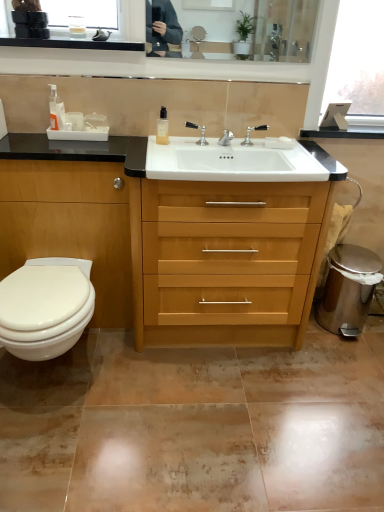
The width and height of the screenshot is (384, 512). I want to click on vacant space to the right of polished chrome faucet at center, so click(290, 152).